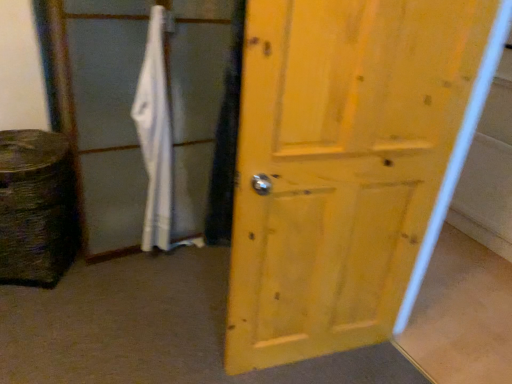
Image resolution: width=512 pixels, height=384 pixels. In order to click on vacant space to the left of white fabric bath towel at center-left in this screenshot , I will do `click(127, 261)`.